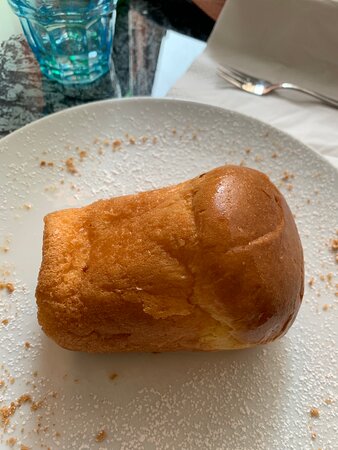
Identify the location of crumb. (101, 437).